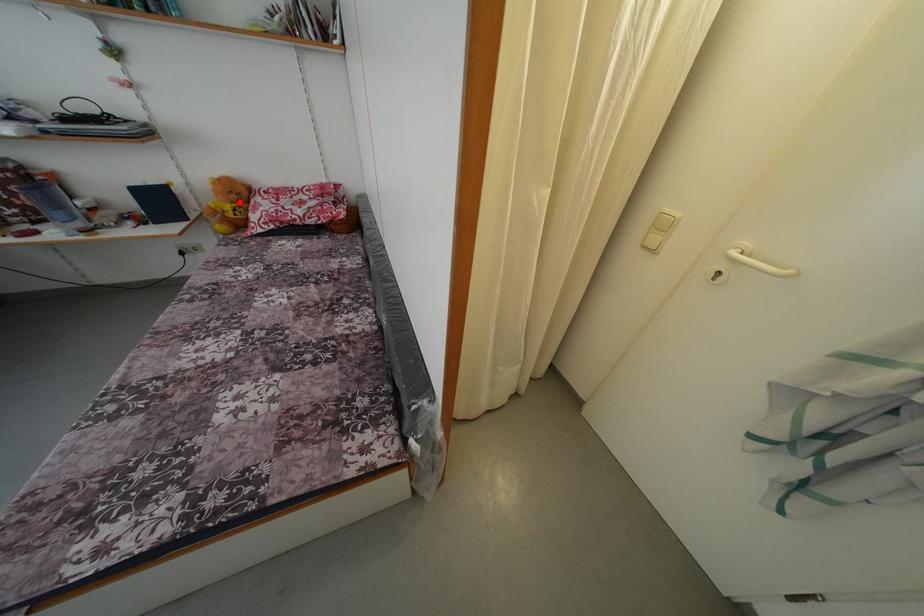
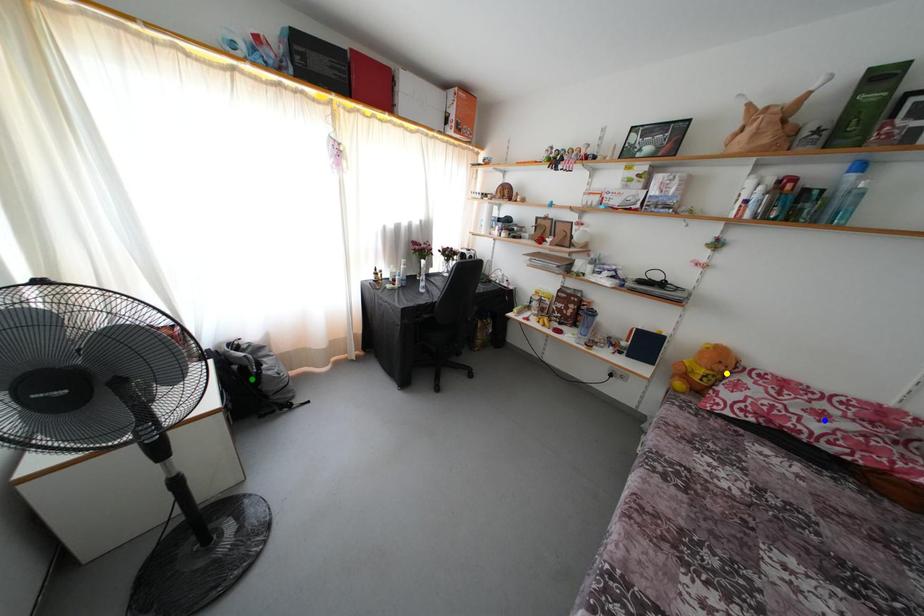
Question: I am providing you with two images of the same scene from different viewpoints. A red point is marked on the first image. You are given multiple points on the second image. Can you choose the point in image 2 that corresponds to the point in image 1?

Choices:
 (A) blue point
 (B) green point
 (C) yellow point

Answer: (C)